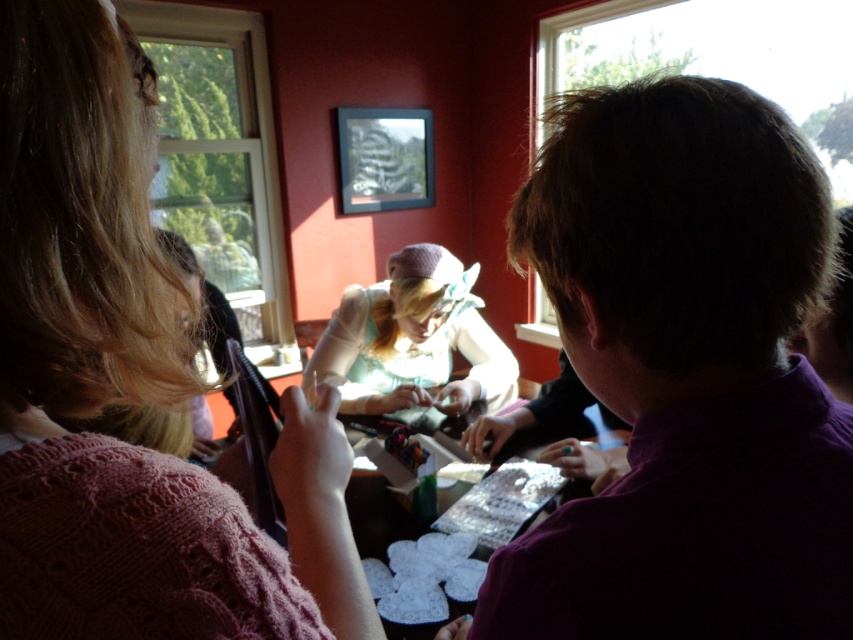
You are standing in the room and want to hand a tool to both the purple shirt at right and the light blue fabric at center. Which one should you approach first to ensure you can reach them without moving around any obstacles?

You should approach the purple shirt at right first because it is closer to you than the light blue fabric at center, so you can reach them more easily without needing to move around obstacles.

You are standing in the room and want to determine which of the two points, point (x=299, y=396) or point (x=440, y=317), is nearer to you. Based on the scene, which point is closer?

Point (x=299, y=396) is closer to the camera than point (x=440, y=317), so it is the nearer one.

Consider the image. You are standing in the room and want to greet the person in the purple shirt at right. Which direction should you move relative to the knitted pink sweater at left?

You should move to the right of the knitted pink sweater at left to reach the purple shirt at right.